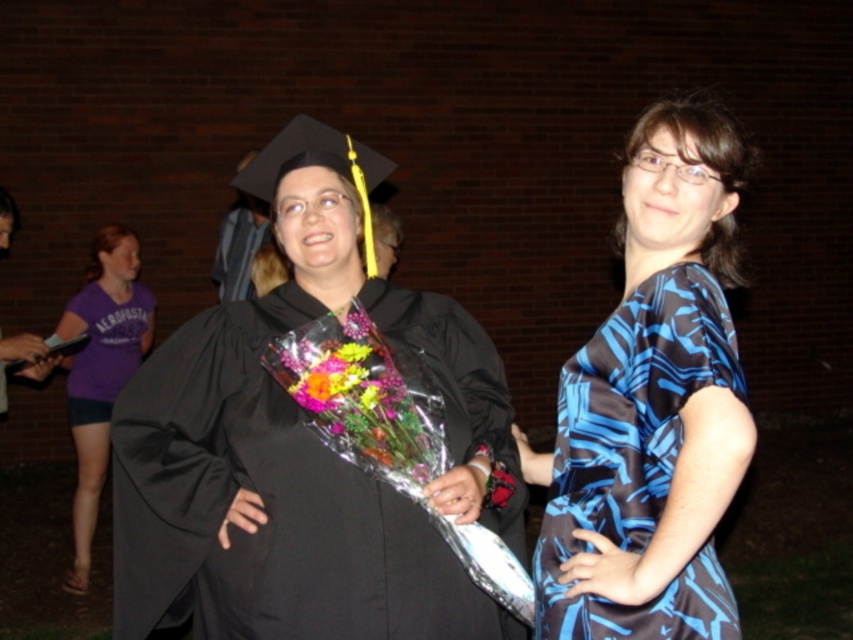
Question: Does matte black graduation cap at upper center appear under vibrant floral bouquet at center?

Choices:
 (A) no
 (B) yes

Answer: (A)

Question: Does matte black gown at center have a smaller size compared to blue printed dress at center?

Choices:
 (A) no
 (B) yes

Answer: (B)

Question: Which is nearer to the purple cotton t-shirt at left?

Choices:
 (A) matte black gown at center
 (B) purple cotton t-shirt at lower left
 (C) matte black graduation cap at upper center

Answer: (B)

Question: Can you confirm if purple cotton t-shirt at left is smaller than matte black graduation cap at upper center?

Choices:
 (A) no
 (B) yes

Answer: (B)

Question: Which object is farther from the camera taking this photo?

Choices:
 (A) matte black graduation cap at upper center
 (B) vibrant floral bouquet at center

Answer: (A)

Question: Which point appears closest to the camera in this image?

Choices:
 (A) (390, 461)
 (B) (511, 525)

Answer: (A)